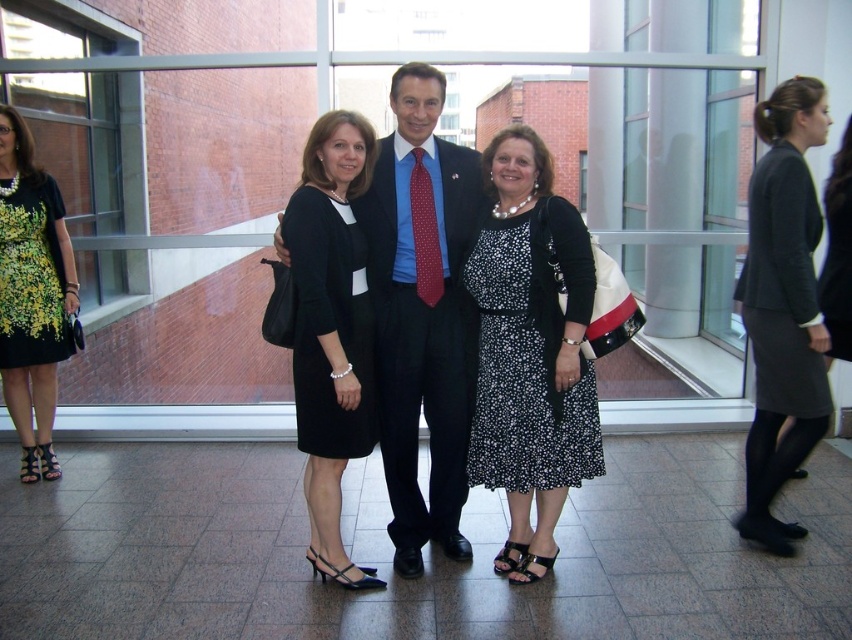
Question: Based on their relative distances, which object is farther from the floral dress at left?

Choices:
 (A) printed fabric dress at left
 (B) dark gray wool skirt at right

Answer: (B)

Question: Does black dotted dress at center appear on the left side of printed fabric dress at left?

Choices:
 (A) yes
 (B) no

Answer: (B)

Question: Which object is the farthest from the black dotted dress at center?

Choices:
 (A) dark gray wool skirt at right
 (B) floral dress at left
 (C) dark blue suit at center

Answer: (B)

Question: Is black dotted dress at center bigger than dark gray wool skirt at right?

Choices:
 (A) no
 (B) yes

Answer: (A)

Question: Can you confirm if black dotted dress at center is thinner than floral dress at left?

Choices:
 (A) yes
 (B) no

Answer: (B)

Question: Which of the following is the closest to the observer?

Choices:
 (A) dark blue suit at center
 (B) black dotted dress at center
 (C) printed fabric dress at left
 (D) dark gray wool skirt at right

Answer: (B)